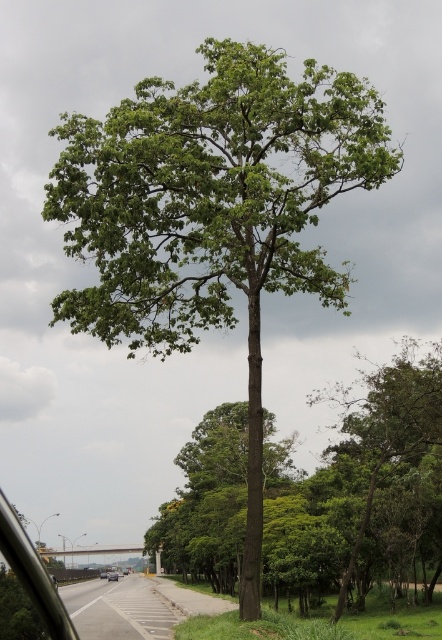
You are a passenger in a car and want to see the tall tree on the right. Which object, the transparent glass car window at lower left or the silver metallic sedan at center, would allow you to see the tree better?

The silver metallic sedan at center is taller than the transparent glass car window at lower left, so the silver metallic sedan at center would provide a better view of the tall tree on the right.

You are sitting in the silver metallic sedan at center and want to look out through the transparent glass car window at lower left. Can you see the tall tree on the right side of the frame through the window?

The transparent glass car window at lower left is closer to the viewer than the silver metallic sedan at center, so you cannot see the tall tree on the right side of the frame through the window because the window is in front of the sedan and blocking the view.